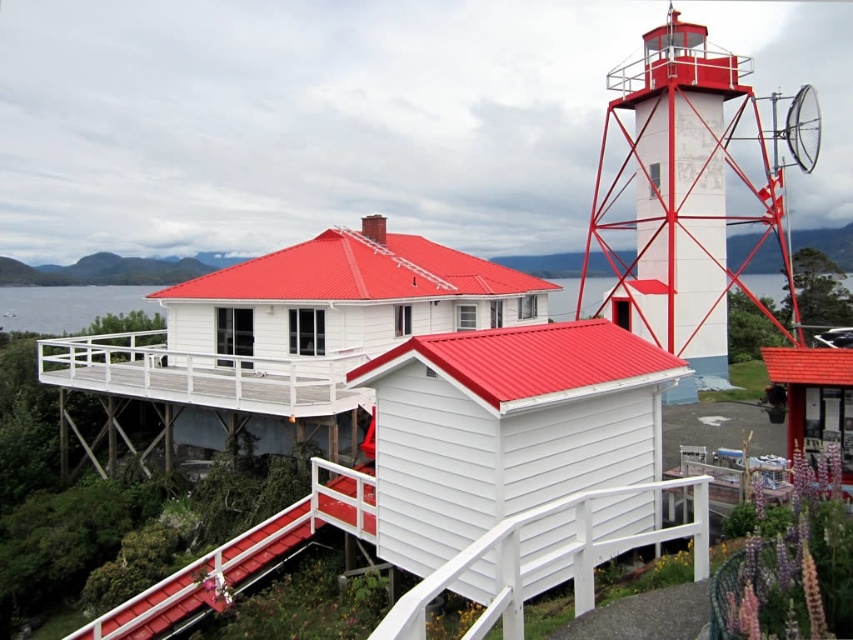
Question: Among these points, which one is farthest from the camera?

Choices:
 (A) (283, 518)
 (B) (747, 92)
 (C) (416, 595)

Answer: (B)

Question: Which of the following is the farthest from the observer?

Choices:
 (A) white painted wood at lower center
 (B) transparent water at lower left
 (C) smooth wood handrail at center

Answer: (B)

Question: Is white painted metal tower at upper right above white painted wood at lower center?

Choices:
 (A) yes
 (B) no

Answer: (A)

Question: Which of these objects is positioned closest to the white painted wood at lower center?

Choices:
 (A) white painted metal tower at upper right
 (B) smooth wood handrail at center
 (C) transparent water at lower left

Answer: (B)

Question: Is the position of white painted metal tower at upper right less distant than that of transparent water at lower left?

Choices:
 (A) yes
 (B) no

Answer: (A)

Question: In this image, where is smooth wood handrail at center located relative to white painted wood at lower center?

Choices:
 (A) right
 (B) left

Answer: (B)